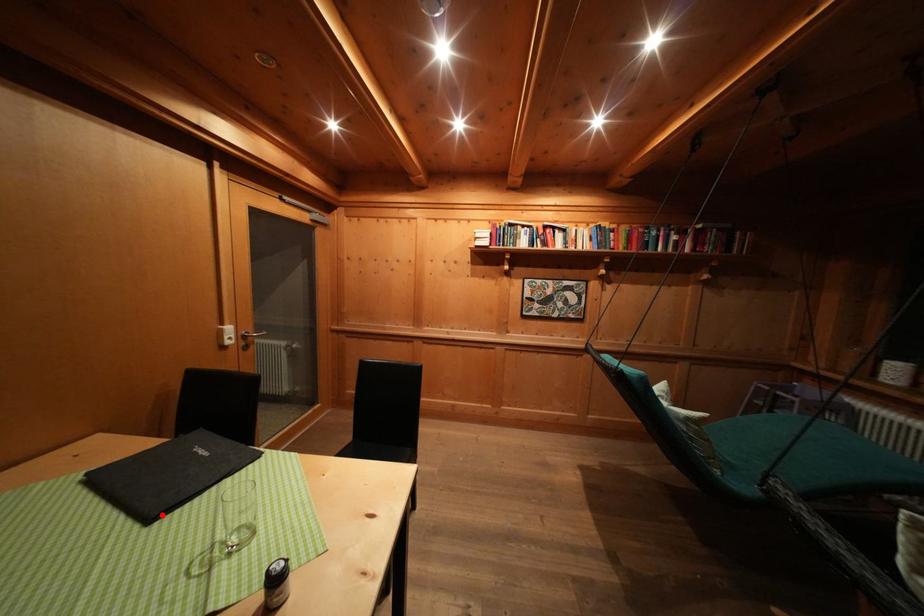
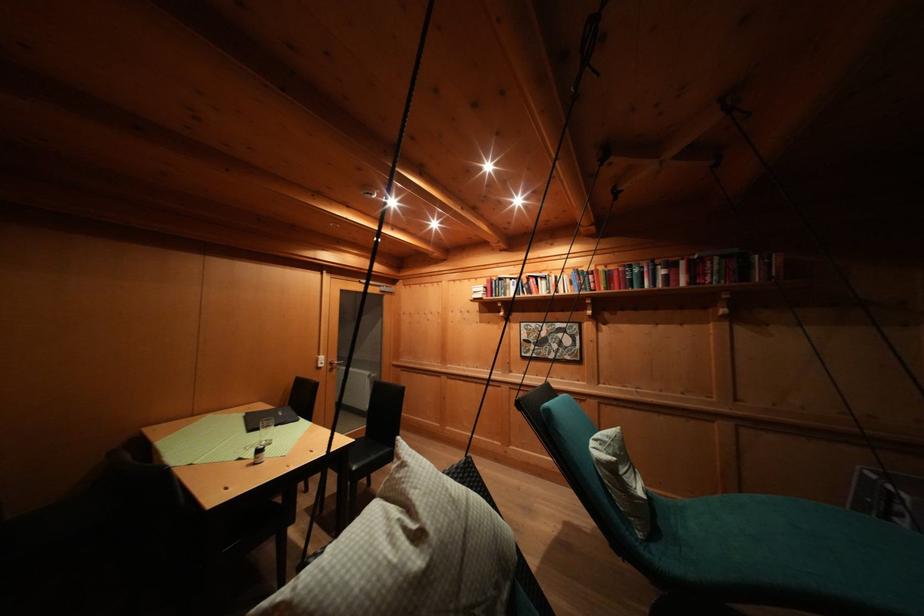
The point at the highlighted location is marked in the first image. Where is the corresponding point in the second image?

(259, 434)